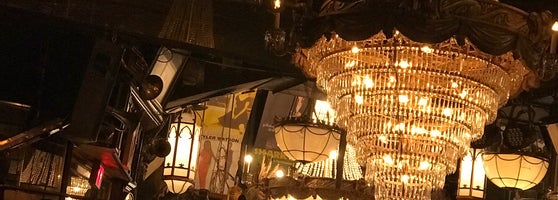
I want to click on to the right of the ceiling lights, so click(x=553, y=180).